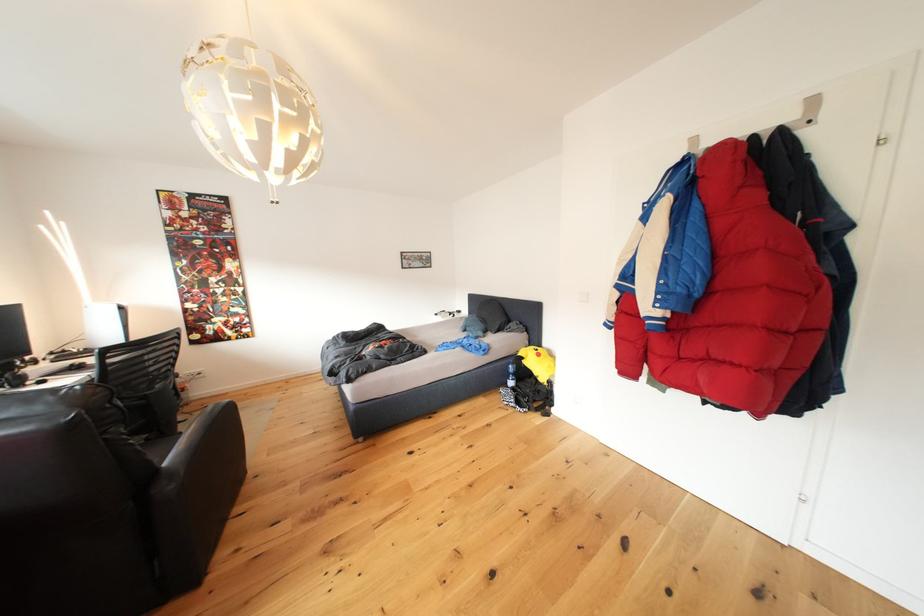
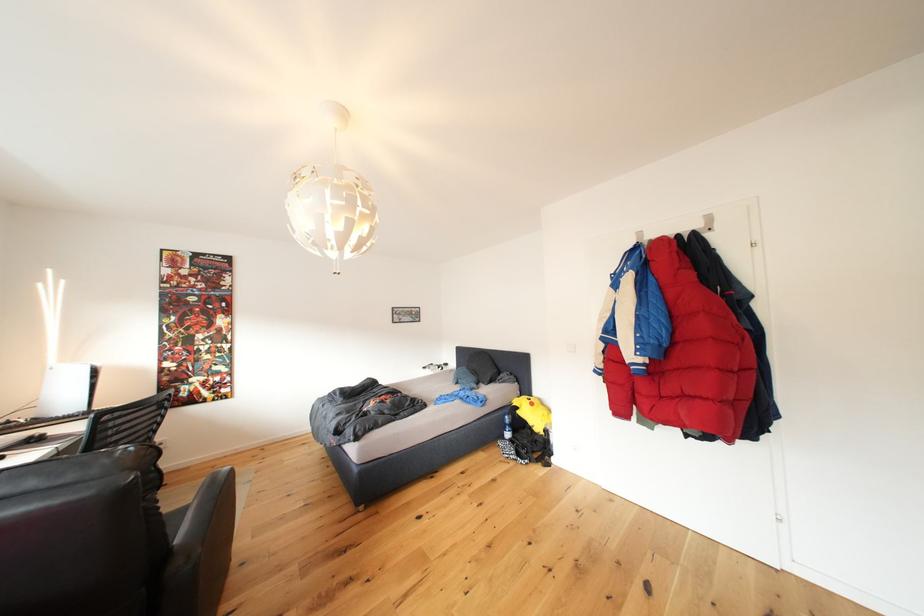
Question: The images are taken continuously from a first-person perspective. In which direction is your viewpoint rotating?

Choices:
 (A) Left
 (B) Right
 (C) Up
 (D) Down

Answer: (C)